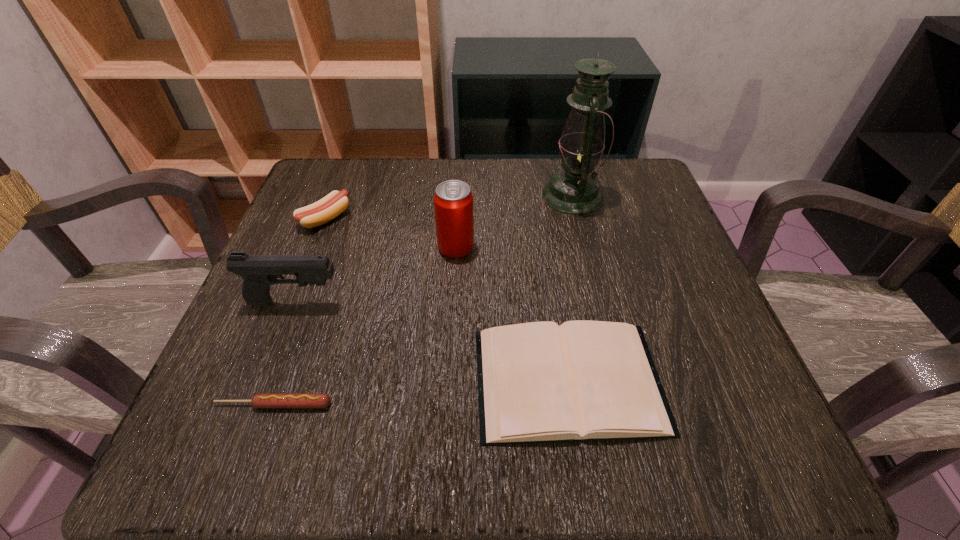
Where is `oil lamp`? The image size is (960, 540). oil lamp is located at coordinates (575, 189).

In order to click on the third object from right to left in this screenshot , I will do `click(453, 201)`.

Where is `can`? The height and width of the screenshot is (540, 960). can is located at coordinates pyautogui.click(x=453, y=201).

Identify the location of the third nearest object. The height and width of the screenshot is (540, 960). (259, 272).

Locate an element on the screen. The width and height of the screenshot is (960, 540). pistol is located at coordinates (259, 272).

At what (x,y) coordinates should I click in order to perform the action: click on the farther sausage. Please return your answer as a coordinate pair (x, y). The image size is (960, 540). Looking at the image, I should click on (332, 205).

Identify the location of the taller sausage. (332, 205).

This screenshot has width=960, height=540. I want to click on hardback book, so click(538, 382).

Locate an element on the screen. Image resolution: width=960 pixels, height=540 pixels. the shortest object is located at coordinates click(262, 400).

You are a GUI agent. You are given a task and a screenshot of the screen. Output one action in this format:
    pyautogui.click(x=<x>, y=<y>)
    Task: Click on the shorter sausage
    The width and height of the screenshot is (960, 540).
    Given the screenshot: What is the action you would take?
    pyautogui.click(x=262, y=400)